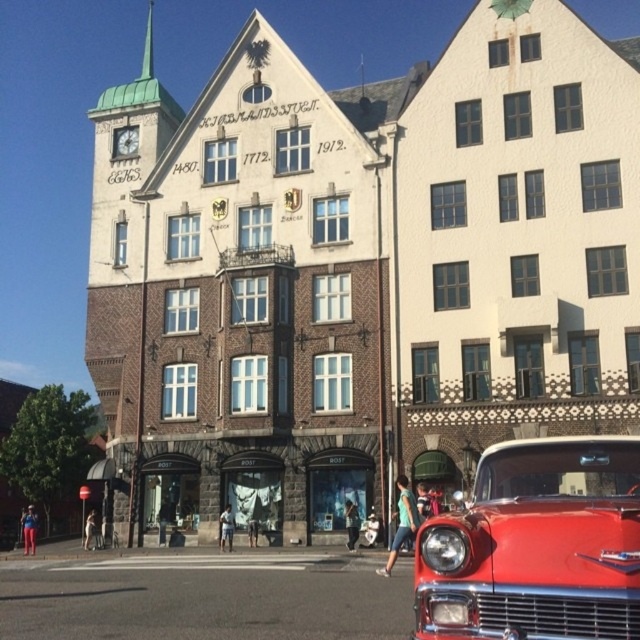
Question: Estimate the real-world distances between objects in this image. Which object is closer to the white painted wood building at center?

Choices:
 (A) brick building at center
 (B) shiny red car at lower right

Answer: (A)

Question: Is brick building at center wider than white painted wood building at center?

Choices:
 (A) no
 (B) yes

Answer: (B)

Question: Does white painted wood building at center appear under shiny red car at lower right?

Choices:
 (A) yes
 (B) no

Answer: (B)

Question: Which of the following is the farthest from the observer?

Choices:
 (A) (593, 524)
 (B) (630, 195)
 (C) (467, 312)

Answer: (C)

Question: Which of the following is the farthest from the observer?

Choices:
 (A) white painted wood building at center
 (B) shiny red car at lower right
 (C) brick building at center

Answer: (C)

Question: Is the position of brick building at center less distant than that of white painted wood building at center?

Choices:
 (A) yes
 (B) no

Answer: (B)